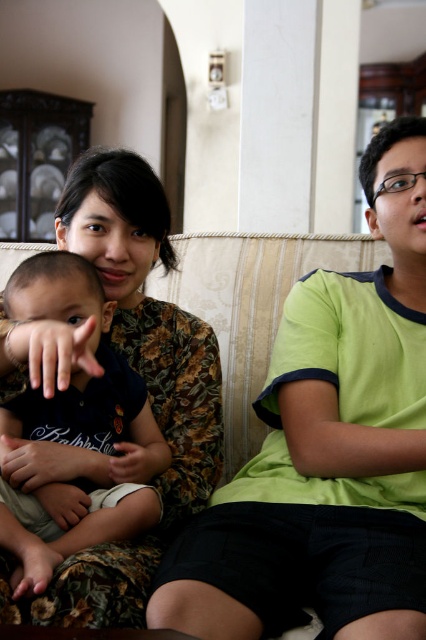
Can you confirm if dark blue fabric baby at left is positioned below beige fabric couch at center?

Indeed, dark blue fabric baby at left is positioned under beige fabric couch at center.

Does dark blue fabric baby at left lie in front of beige fabric couch at center?

That is True.

Image resolution: width=426 pixels, height=640 pixels. Describe the element at coordinates (74, 428) in the screenshot. I see `dark blue fabric baby at left` at that location.

The width and height of the screenshot is (426, 640). In order to click on dark blue fabric baby at left in this screenshot , I will do `click(74, 428)`.